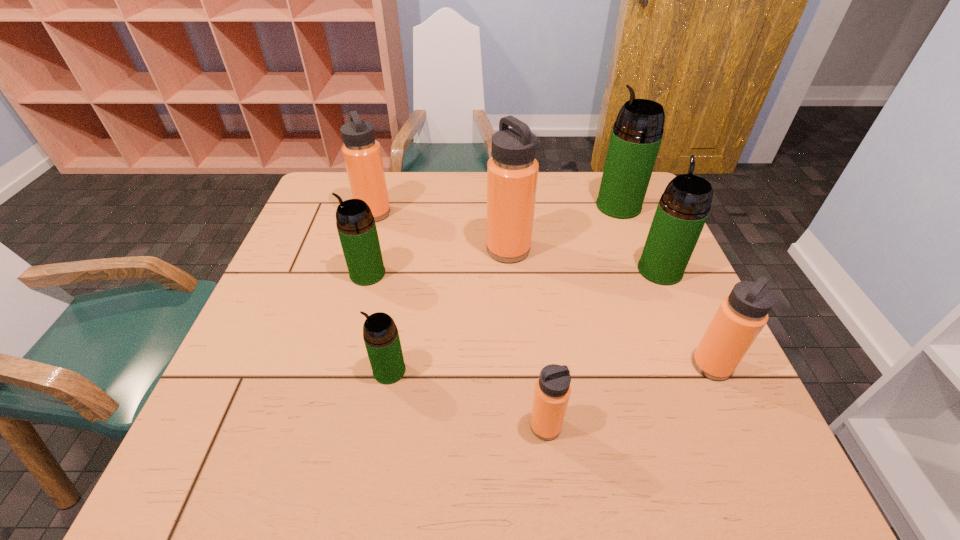
Find the location of a particular element. free space between the third object from left to right and the second biggest orange thermos bottle is located at coordinates (382, 292).

I want to click on vacant region between the third thermos bottle from left to right and the biggest green thermos bottle, so click(504, 288).

Select which object is the closest to the farthest green thermos bottle. Please provide its 2D coordinates. Your answer should be formatted as a tuple, i.e. [(x, y)], where the tuple contains the x and y coordinates of a point satisfying the conditions above.

[(683, 208)]

Locate an element on the screen. object that stands as the sixth closest to the farthest orange thermos bottle is located at coordinates (552, 391).

You are a GUI agent. You are given a task and a screenshot of the screen. Output one action in this format:
    pyautogui.click(x=<x>, y=<y>)
    Task: Click on the thermos bottle identified as the third closest to the leftmost green thermos bottle
    This screenshot has width=960, height=540.
    Given the screenshot: What is the action you would take?
    pyautogui.click(x=512, y=172)

I want to click on the seventh closest thermos bottle relative to the second biggest orange thermos bottle, so click(x=741, y=316).

Identify the location of green thermos bottle that is the fourth nearest to the second smallest orange thermos bottle. (356, 227).

You are a GUI agent. You are given a task and a screenshot of the screen. Output one action in this format:
    pyautogui.click(x=<x>, y=<y>)
    Task: Click on the green thermos bottle that is the nearest to the third thermos bottle from left to right
    
    Given the screenshot: What is the action you would take?
    pyautogui.click(x=356, y=227)

The height and width of the screenshot is (540, 960). In order to click on orange thermos bottle object that ranks as the third closest to the biggest green thermos bottle in this screenshot , I will do `click(362, 154)`.

The height and width of the screenshot is (540, 960). Identify the location of orange thermos bottle that can be found as the closest to the third nearest orange thermos bottle. (362, 154).